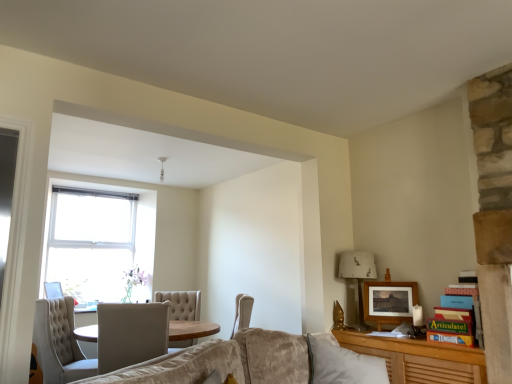
Question: Can you confirm if matte wooden picture frame at upper right, which ranks as the 2th picture frame in back-to-front order, is shorter than white tufted chair at center, marked as the 1th chair in a right-to-left arrangement?

Choices:
 (A) no
 (B) yes

Answer: (B)

Question: Is matte wooden picture frame at upper right, which ranks as the 2th picture frame in back-to-front order, taller than white tufted chair at center, which is counted as the second chair, starting from the left?

Choices:
 (A) yes
 (B) no

Answer: (B)

Question: Is matte wooden picture frame at upper right, which is the first picture frame in front-to-back order, completely or partially outside of white tufted chair at center, which is counted as the second chair, starting from the left?

Choices:
 (A) yes
 (B) no

Answer: (A)

Question: Is matte wooden picture frame at upper right, marked as the second picture frame in a bottom-to-top arrangement, wider than white tufted chair at center, marked as the 1th chair in a right-to-left arrangement?

Choices:
 (A) no
 (B) yes

Answer: (A)

Question: Is matte wooden picture frame at upper right, marked as the second picture frame in a bottom-to-top arrangement, looking in the opposite direction of white tufted chair at center, which is counted as the second chair, starting from the left?

Choices:
 (A) yes
 (B) no

Answer: (B)

Question: Is matte wooden picture frame at upper right, which ranks as the 2th picture frame in back-to-front order, facing towards white tufted chair at center, which is counted as the second chair, starting from the left?

Choices:
 (A) yes
 (B) no

Answer: (B)

Question: From the image's perspective, is matte wooden picture frame at upper right, marked as the second picture frame in a bottom-to-top arrangement, located beneath tufted fabric chair at lower left, the second chair viewed from the right?

Choices:
 (A) no
 (B) yes

Answer: (A)

Question: Is matte wooden picture frame at upper right, which ranks as the 2th picture frame in back-to-front order, taller than tufted fabric chair at lower left, the second chair viewed from the right?

Choices:
 (A) yes
 (B) no

Answer: (B)

Question: Does matte wooden picture frame at upper right, which ranks as the 2th picture frame in back-to-front order, lie behind tufted fabric chair at lower left, the first chair from the left?

Choices:
 (A) no
 (B) yes

Answer: (A)

Question: From a real-world perspective, is matte wooden picture frame at upper right, which ranks as the 2th picture frame in back-to-front order, on top of tufted fabric chair at lower left, the first chair from the left?

Choices:
 (A) yes
 (B) no

Answer: (A)

Question: Is matte wooden picture frame at upper right, which is the first picture frame in front-to-back order, to the left of tufted fabric chair at lower left, the second chair viewed from the right, from the viewer's perspective?

Choices:
 (A) no
 (B) yes

Answer: (A)

Question: From a real-world perspective, does wooden picture frame at lower left, positioned as the 1th picture frame in left-to-right order, sit lower than white tufted chair at center, which is counted as the second chair, starting from the left?

Choices:
 (A) yes
 (B) no

Answer: (B)